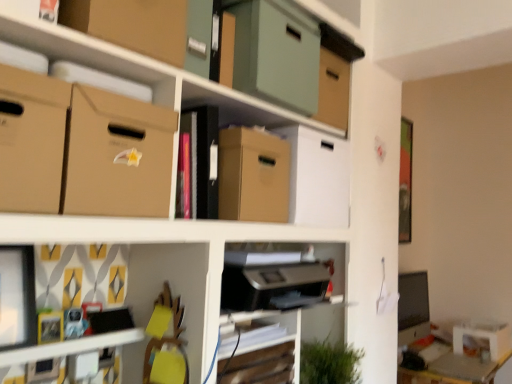
Question: Does wooden swivel chair at lower center have a lesser width compared to matte green cardboard box at upper center, positioned as the fourth cardboard box in bottom-to-top order?

Choices:
 (A) yes
 (B) no

Answer: (A)

Question: Can you confirm if wooden swivel chair at lower center is positioned to the left of matte green cardboard box at upper center, positioned as the fourth cardboard box in bottom-to-top order?

Choices:
 (A) yes
 (B) no

Answer: (A)

Question: From the image's perspective, would you say wooden swivel chair at lower center is positioned over matte green cardboard box at upper center, positioned as the fourth cardboard box in bottom-to-top order?

Choices:
 (A) no
 (B) yes

Answer: (A)

Question: Would you consider wooden swivel chair at lower center to be distant from matte green cardboard box at upper center, positioned as the fourth cardboard box in bottom-to-top order?

Choices:
 (A) no
 (B) yes

Answer: (A)

Question: Considering the relative positions of wooden swivel chair at lower center and matte green cardboard box at upper center, the second cardboard box from the top, in the image provided, is wooden swivel chair at lower center to the right of matte green cardboard box at upper center, the second cardboard box from the top, from the viewer's perspective?

Choices:
 (A) no
 (B) yes

Answer: (A)

Question: From the image's perspective, does wooden swivel chair at lower center appear lower than matte green cardboard box at upper center, the second cardboard box from the top?

Choices:
 (A) no
 (B) yes

Answer: (B)

Question: Is the position of matte brown cardboard box at upper left, the first cardboard box in the top-to-bottom sequence, more distant than that of matte cardboard boxes at upper center?

Choices:
 (A) yes
 (B) no

Answer: (A)

Question: Is matte brown cardboard box at upper left, the first cardboard box in the top-to-bottom sequence, oriented towards matte cardboard boxes at upper center?

Choices:
 (A) yes
 (B) no

Answer: (A)

Question: Could matte cardboard boxes at upper center be considered to be inside matte brown cardboard box at upper left, the first cardboard box in the top-to-bottom sequence?

Choices:
 (A) yes
 (B) no

Answer: (B)

Question: Considering the relative sizes of matte brown cardboard box at upper left, arranged as the 5th cardboard box when ordered from the bottom, and matte cardboard boxes at upper center in the image provided, is matte brown cardboard box at upper left, arranged as the 5th cardboard box when ordered from the bottom, shorter than matte cardboard boxes at upper center?

Choices:
 (A) yes
 (B) no

Answer: (A)

Question: Is matte brown cardboard box at upper left, arranged as the 5th cardboard box when ordered from the bottom, looking in the opposite direction of matte cardboard boxes at upper center?

Choices:
 (A) yes
 (B) no

Answer: (A)

Question: From a real-world perspective, is matte brown cardboard box at upper left, arranged as the 5th cardboard box when ordered from the bottom, on matte cardboard boxes at upper center?

Choices:
 (A) yes
 (B) no

Answer: (A)

Question: Would you consider matte brown cardboard box at upper left, arranged as the 5th cardboard box when ordered from the bottom, to be distant from wooden table at lower right?

Choices:
 (A) no
 (B) yes

Answer: (B)